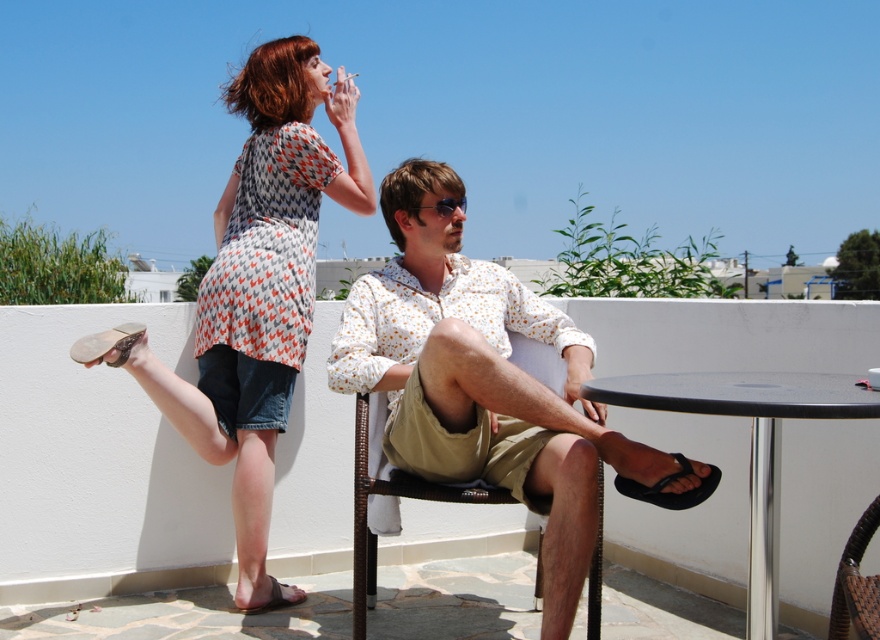
Can you confirm if printed cotton dress at upper left is bigger than woven rattan chair at center?

Indeed, printed cotton dress at upper left has a larger size compared to woven rattan chair at center.

Between point (294, 323) and point (470, 500), which one is positioned behind?

Point (294, 323)

Locate an element on the screen. This screenshot has width=880, height=640. printed cotton dress at upper left is located at coordinates (262, 288).

Can you confirm if black plastic table at lower right is shorter than woven brown chair at lower right?

Incorrect, black plastic table at lower right's height does not fall short of woven brown chair at lower right's.

Can you confirm if black plastic table at lower right is thinner than woven brown chair at lower right?

In fact, black plastic table at lower right might be wider than woven brown chair at lower right.

What are the coordinates of `black plastic table at lower right` in the screenshot? It's located at (750, 444).

Is point (368, 413) less distant than point (878, 625)?

No, (368, 413) is further to viewer.

Is point (361, 611) in front of point (856, 605)?

No, it is not.

Locate an element on the screen. The width and height of the screenshot is (880, 640). woven rattan chair at center is located at coordinates (394, 496).